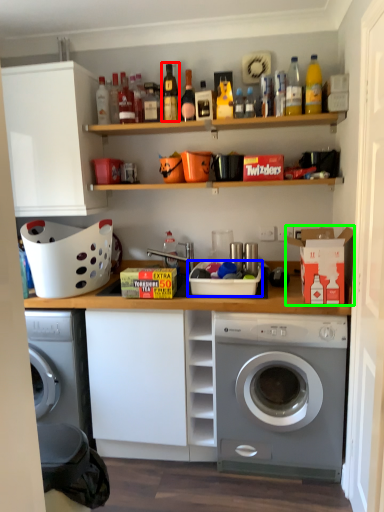
Question: Which object is positioned closest to bottle (highlighted by a red box)? Select from basket (highlighted by a blue box) and cardboard box (highlighted by a green box).

Choices:
 (A) basket
 (B) cardboard box

Answer: (A)